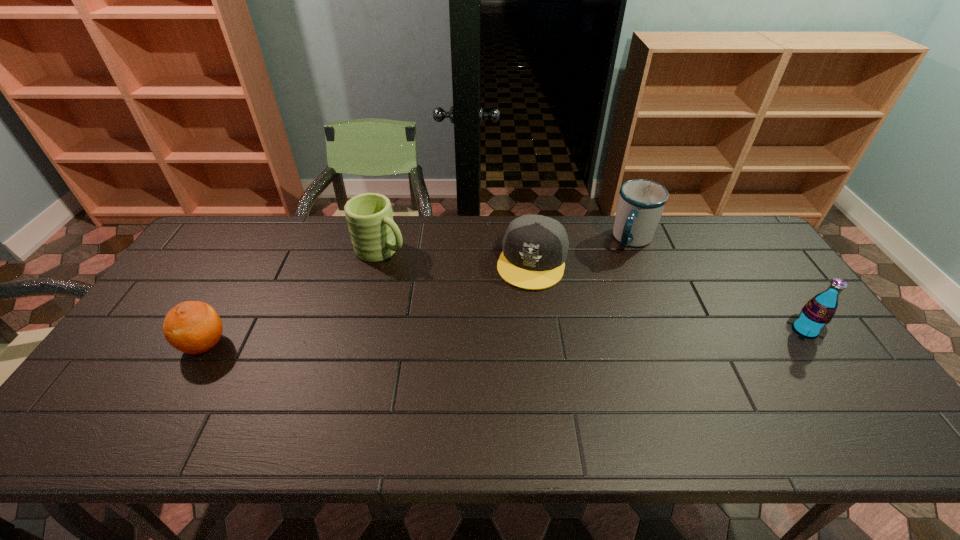
The image size is (960, 540). Find the location of `the leftmost object`. the leftmost object is located at coordinates (193, 327).

You are a GUI agent. You are given a task and a screenshot of the screen. Output one action in this format:
    pyautogui.click(x=<x>, y=<y>)
    Task: Click on the rightmost object
    The image size is (960, 540).
    Given the screenshot: What is the action you would take?
    pyautogui.click(x=811, y=323)

I want to click on the third object from right to left, so click(535, 247).

Image resolution: width=960 pixels, height=540 pixels. What are the coordinates of `the fourth object from left to right` in the screenshot? It's located at (641, 202).

Locate an element on the screen. This screenshot has width=960, height=540. the fourth object from right to left is located at coordinates click(x=375, y=237).

Find the location of a particular element. free spot located 0.110m on the right of the orange is located at coordinates (272, 345).

In order to click on free spot located on the back of the soda in this screenshot , I will do `click(763, 271)`.

What are the coordinates of `vacant region located 0.400m on the front-facing side of the cap` in the screenshot? It's located at (492, 406).

You are a GUI agent. You are given a task and a screenshot of the screen. Output one action in this format:
    pyautogui.click(x=<x>, y=<y>)
    Task: Click on the vacant space situated 0.090m on the front-facing side of the cap
    Image resolution: width=960 pixels, height=540 pixels.
    Given the screenshot: What is the action you would take?
    pyautogui.click(x=519, y=312)

Locate an element on the screen. vacant space located 0.160m on the front-facing side of the cap is located at coordinates (515, 330).